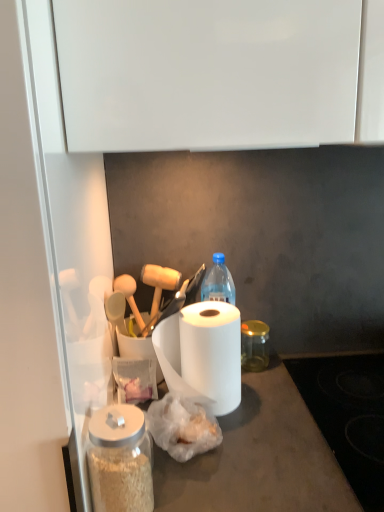
Question: Is transparent glass jar at center, placed as the second glass jar when sorted from front to back, bigger than transparent glass jar at lower left, the first glass jar viewed from the left?

Choices:
 (A) no
 (B) yes

Answer: (A)

Question: Is there a large distance between transparent glass jar at center, which is the second glass jar from left to right, and transparent glass jar at lower left, which ranks as the 2th glass jar in back-to-front order?

Choices:
 (A) yes
 (B) no

Answer: (B)

Question: Is transparent glass jar at center, placed as the second glass jar when sorted from front to back, beside transparent glass jar at lower left, the second glass jar in the right-to-left sequence?

Choices:
 (A) yes
 (B) no

Answer: (B)

Question: Is transparent glass jar at center, which is the second glass jar from left to right, shorter than transparent glass jar at lower left, which ranks as the 2th glass jar in back-to-front order?

Choices:
 (A) no
 (B) yes

Answer: (B)

Question: Considering the relative positions of transparent glass jar at center, placed as the second glass jar when sorted from front to back, and transparent glass jar at lower left, the second glass jar in the right-to-left sequence, in the image provided, is transparent glass jar at center, placed as the second glass jar when sorted from front to back, behind transparent glass jar at lower left, the second glass jar in the right-to-left sequence,?

Choices:
 (A) no
 (B) yes

Answer: (B)

Question: Can we say transparent glass jar at center, placed as the second glass jar when sorted from front to back, lies outside transparent glass jar at lower left, which ranks as the 2th glass jar in back-to-front order?

Choices:
 (A) no
 (B) yes

Answer: (B)

Question: Would you say white matte paper towel at center is outside transparent glass jar at center, the 1th glass jar from the back?

Choices:
 (A) yes
 (B) no

Answer: (A)

Question: Is white matte paper towel at center facing away from transparent glass jar at center, placed as the second glass jar when sorted from front to back?

Choices:
 (A) yes
 (B) no

Answer: (B)

Question: From a real-world perspective, does white matte paper towel at center sit lower than transparent glass jar at center, the 1th glass jar from the back?

Choices:
 (A) yes
 (B) no

Answer: (B)

Question: Does white matte paper towel at center contain transparent glass jar at center, the 1th glass jar from the back?

Choices:
 (A) yes
 (B) no

Answer: (B)

Question: Can you confirm if white matte paper towel at center is positioned to the right of transparent glass jar at center, placed as the second glass jar when sorted from front to back?

Choices:
 (A) no
 (B) yes

Answer: (A)

Question: From the image's perspective, is white matte paper towel at center on transparent glass jar at center, which is the second glass jar from left to right?

Choices:
 (A) no
 (B) yes

Answer: (A)

Question: From the image's perspective, is white matte paper towel at center on top of transparent glass jar at lower left, arranged as the 1th glass jar when viewed from the front?

Choices:
 (A) yes
 (B) no

Answer: (A)